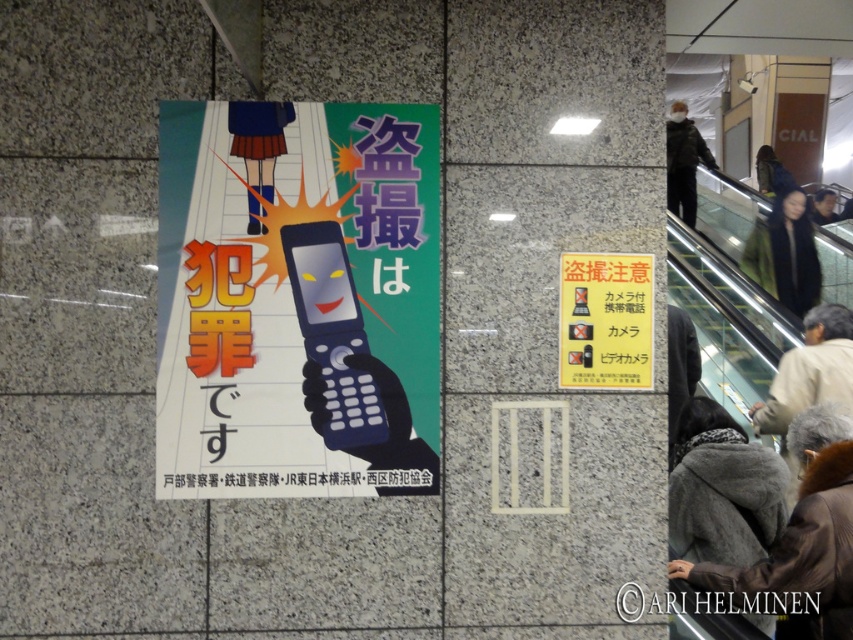
Question: Can you confirm if light beige jacket at lower right is bigger than dark gray hooded jacket at lower right?

Choices:
 (A) yes
 (B) no

Answer: (A)

Question: Which point appears farthest from the camera in this image?

Choices:
 (A) (241, 104)
 (B) (682, 374)
 (C) (639, 355)

Answer: (B)

Question: Considering the real-world distances, which object is farthest from the dark gray wool scarf at lower right?

Choices:
 (A) dark blue jacket at upper right
 (B) orange glossy sign at upper right
 (C) dark gray hooded jacket at lower right
 (D) matte blue phone at center

Answer: (A)

Question: Is black fabric at upper right smaller than dark blue jacket at upper right?

Choices:
 (A) yes
 (B) no

Answer: (B)

Question: Is matte blue phone at center positioned before light beige jacket at lower right?

Choices:
 (A) yes
 (B) no

Answer: (A)

Question: Which object is farther from the camera taking this photo?

Choices:
 (A) light beige jacket at lower right
 (B) dark blue jacket at upper right

Answer: (B)